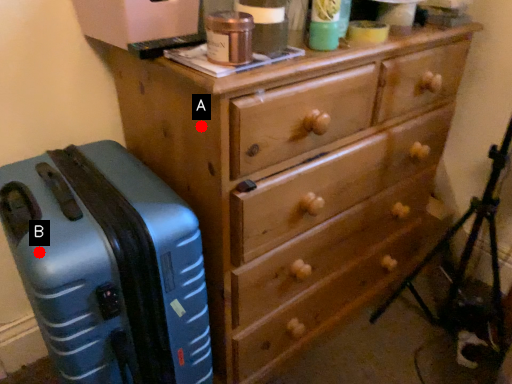
Question: Two points are circled on the image, labeled by A and B beside each circle. Which point is farther from the camera taking this photo?

Choices:
 (A) A is further
 (B) B is further

Answer: (A)